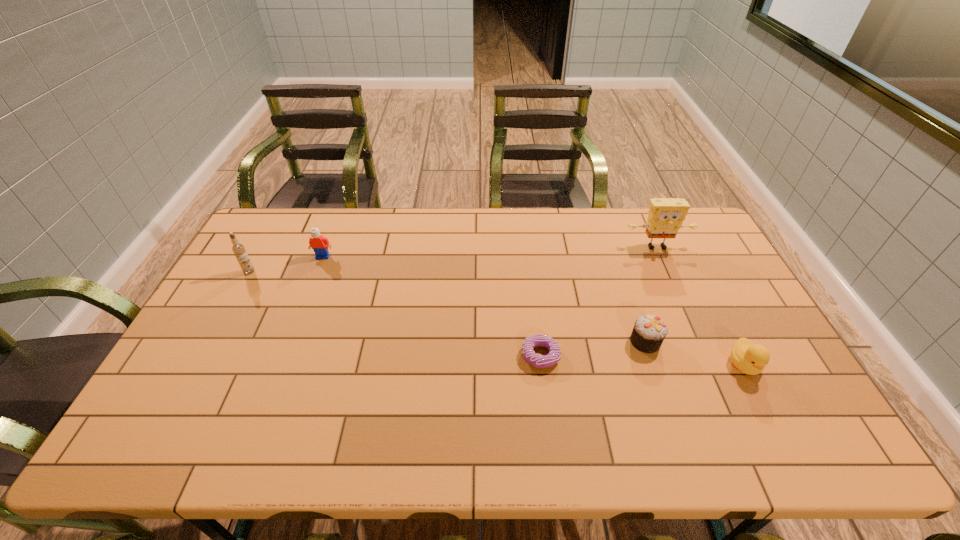
The image size is (960, 540). I want to click on free space that satisfies the following two spatial constraints: 1. on the label of the cupcake; 2. on the right side of the leftmost object, so click(211, 342).

Locate an element on the screen. This screenshot has width=960, height=540. vacant space that satisfies the following two spatial constraints: 1. on the face of the doughnut; 2. on the right side of the Lego is located at coordinates (284, 356).

Where is `vacant space that satisfies the following two spatial constraints: 1. on the label of the cupcake; 2. on the right side of the fourth nearest object`? This screenshot has height=540, width=960. vacant space that satisfies the following two spatial constraints: 1. on the label of the cupcake; 2. on the right side of the fourth nearest object is located at coordinates (x=211, y=342).